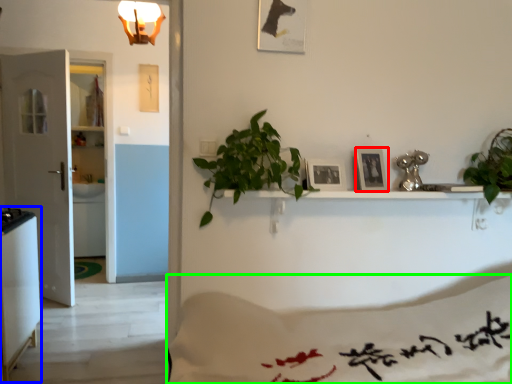
Question: Estimate the real-world distances between objects in this image. Which object is farther from picture frame (highlighted by a red box), appliance (highlighted by a blue box) or sheet (highlighted by a green box)?

Choices:
 (A) appliance
 (B) sheet

Answer: (A)